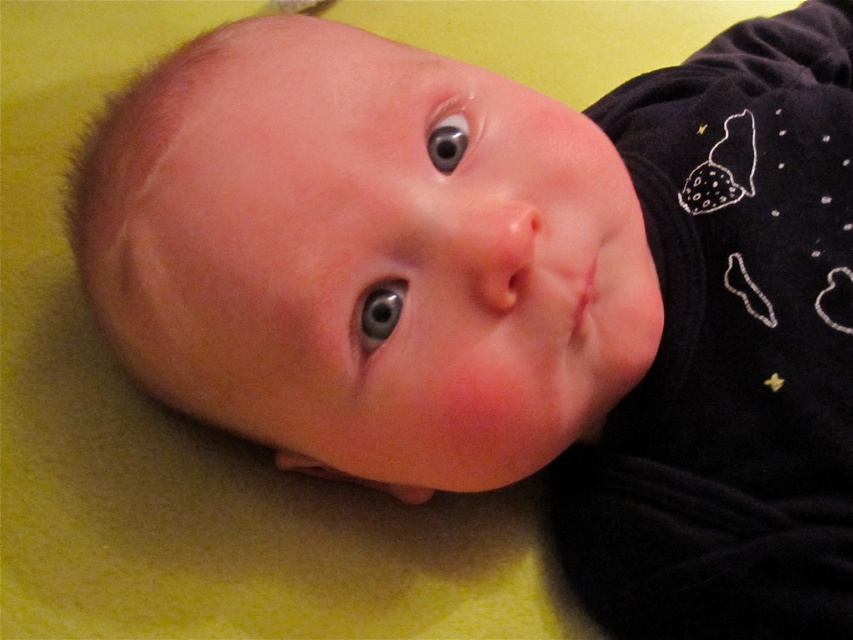
You are a photographer adjusting your camera settings to capture the baby in the image. The camera lens has a focal length of 50mm. To ensure the blue glossy eye at center is in sharp focus, what distance should the lens be focused at?

The blue glossy eye at center is 24.10 inches from the viewer. Therefore, the lens should be focused at 24.10 inches to ensure the blue glossy eye at center is in sharp focus.

You are a photographer adjusting the focus on your camera. You need to focus on either the point at point (366, 346) or point (451, 113) to capture the baby clearly. Which point should you choose to ensure the baby is in focus?

You should focus on point (366, 346) because it is closer to the viewer than point (451, 113), ensuring the baby is in focus.